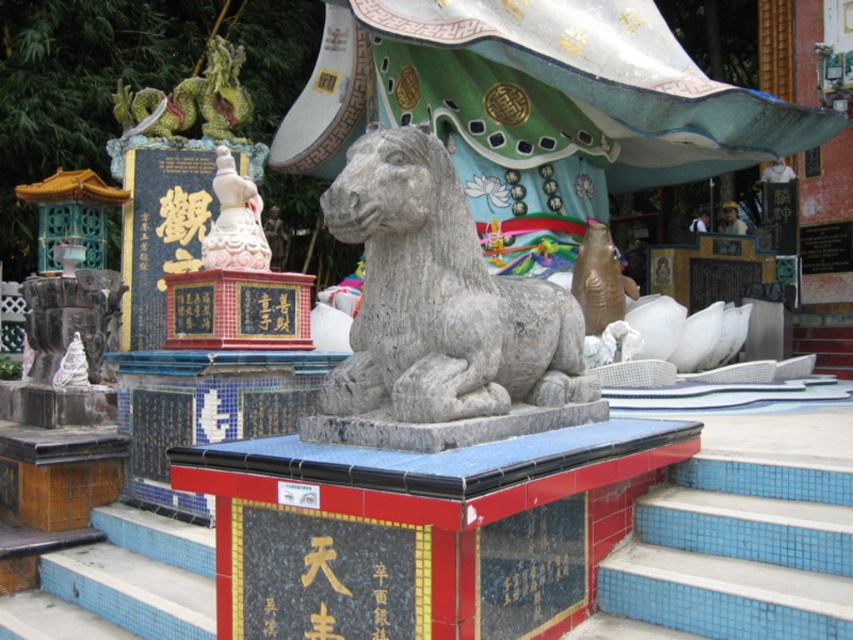
Between gray stone horse at center and white marble statue at upper left, which one appears on the right side from the viewer's perspective?

gray stone horse at center

Which is in front, point (474, 269) or point (262, 260)?

Point (474, 269) is more forward.

You are a GUI agent. You are given a task and a screenshot of the screen. Output one action in this format:
    pyautogui.click(x=<x>, y=<y>)
    Task: Click on the gray stone horse at center
    The width and height of the screenshot is (853, 640).
    Given the screenshot: What is the action you would take?
    pyautogui.click(x=440, y=316)

Is point (55, 369) behind point (254, 209)?

Yes, point (55, 369) is farther from viewer.

Between point (44, 330) and point (265, 243), which one is positioned in front?

Point (265, 243)

Is point (59, 298) farther from viewer compared to point (218, 221)?

That is True.

Identify the location of white marble statue at left. The height and width of the screenshot is (640, 853). (71, 316).

Is point (820, 518) more distant than point (236, 234)?

No.

Between point (850, 525) and point (212, 264), which one is positioned in front?

Point (850, 525) is in front.

The width and height of the screenshot is (853, 640). What are the coordinates of `blue tile stairs at lower left` in the screenshot? It's located at (732, 556).